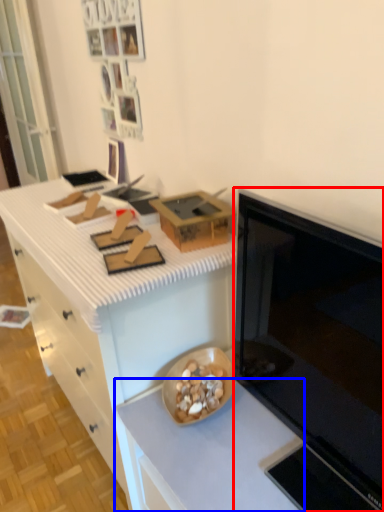
Question: Among these objects, which one is farthest to the camera, microwave oven (highlighted by a red box) or countertop (highlighted by a blue box)?

Choices:
 (A) microwave oven
 (B) countertop

Answer: (B)